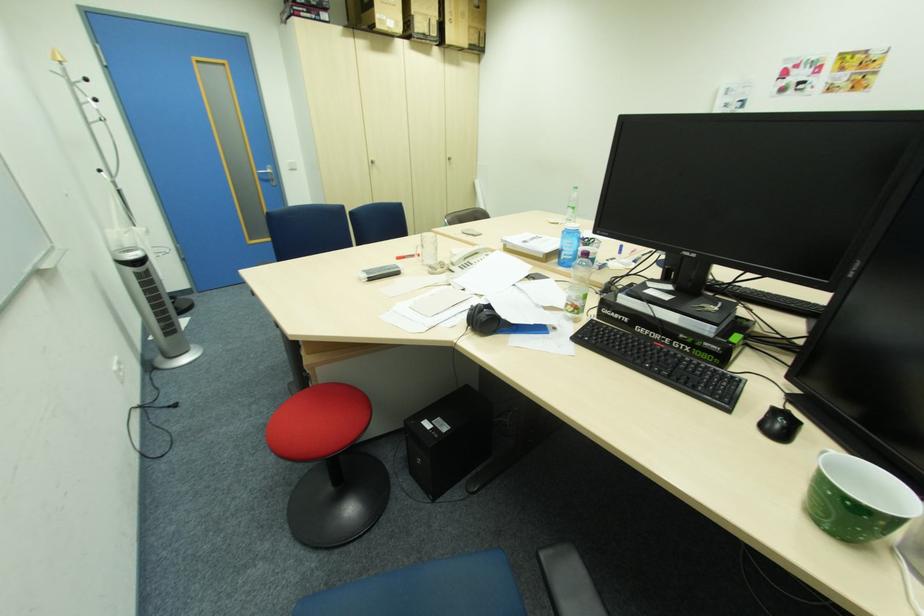
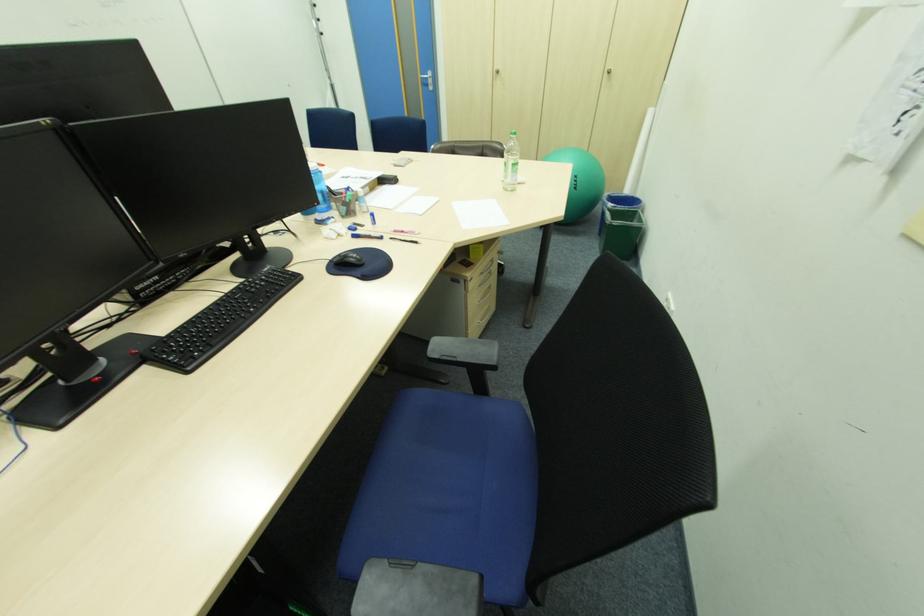
Question: I am providing you with two images of the same scene from different viewpoints. Please identify which objects are invisible in image2.

Choices:
 (A) black desk box
 (B) silver door handle
 (C) water bottle
 (D) green trash can

Answer: (C)